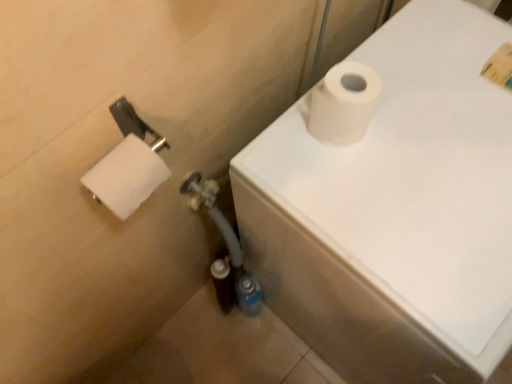
Image resolution: width=512 pixels, height=384 pixels. I want to click on vacant space situated on the left part of white matte toilet paper at upper right, arranged as the 2th toilet paper when viewed from the left, so click(282, 147).